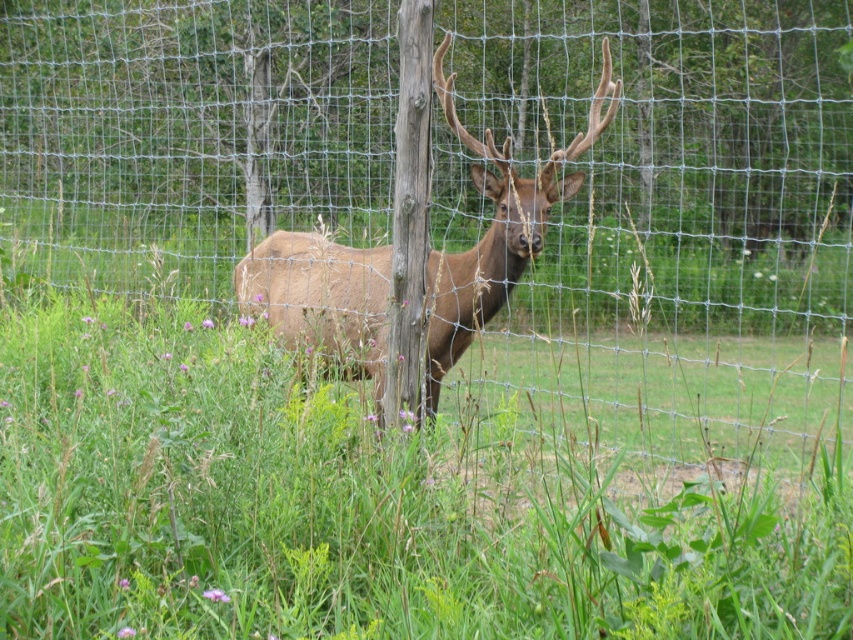
Question: Is green grassy at center below brown velvet deer at center?

Choices:
 (A) no
 (B) yes

Answer: (B)

Question: Based on their relative distances, which object is farther from the brown velvet deer at center?

Choices:
 (A) green grassy at center
 (B) wire mesh fence at center

Answer: (B)

Question: Can you confirm if wire mesh fence at center is smaller than brown velvet deer at center?

Choices:
 (A) no
 (B) yes

Answer: (A)

Question: Does green grassy at center have a greater width compared to brown velvet deer at center?

Choices:
 (A) yes
 (B) no

Answer: (A)

Question: Among these points, which one is nearest to the camera?

Choices:
 (A) (251, 240)
 (B) (244, 262)
 (C) (645, 579)

Answer: (C)

Question: Which point is farther to the camera?

Choices:
 (A) (316, 317)
 (B) (170, 369)

Answer: (A)